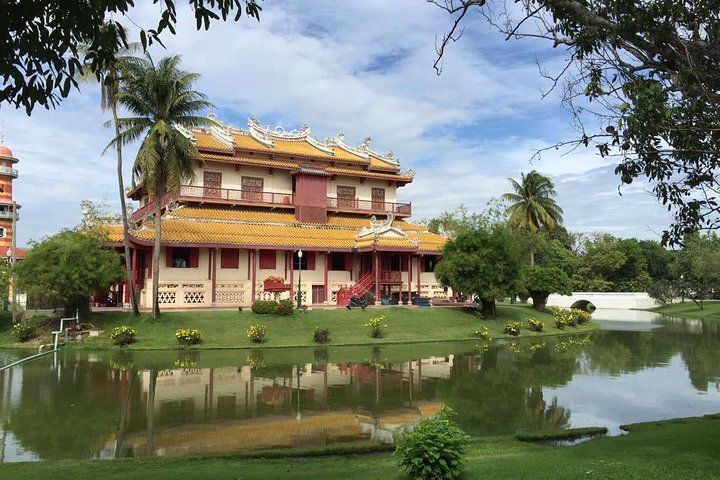
In order to click on stairs in this screenshot , I will do pos(361,283).